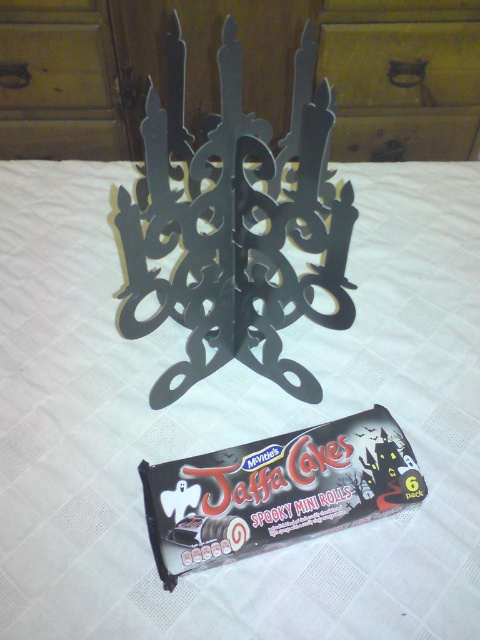
Question: Is dark chocolate bar at center positioned in front of brushed metal drawer at upper center?

Choices:
 (A) yes
 (B) no

Answer: (A)

Question: Estimate the real-world distances between objects in this image. Which object is farther from the matte black candelabra at center?

Choices:
 (A) brushed metal drawer at upper center
 (B) dark chocolate bar at center

Answer: (B)

Question: Considering the relative positions of matte black candelabra at center and brushed metal drawer at upper center in the image provided, where is matte black candelabra at center located with respect to brushed metal drawer at upper center?

Choices:
 (A) left
 (B) right

Answer: (A)

Question: Is matte black candelabra at center to the left of dark chocolate bar at center from the viewer's perspective?

Choices:
 (A) no
 (B) yes

Answer: (B)

Question: Among these objects, which one is nearest to the camera?

Choices:
 (A) dark chocolate bar at center
 (B) matte black candelabra at center
 (C) brushed metal drawer at upper center

Answer: (A)

Question: Which point is closer to the camera?

Choices:
 (A) matte black candelabra at center
 (B) brushed metal drawer at upper center

Answer: (A)